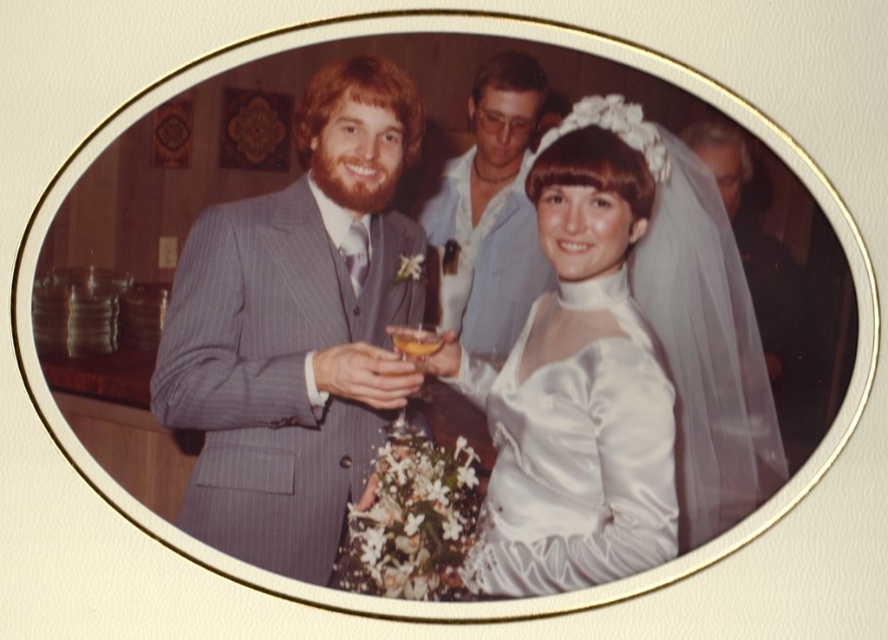
Question: Which of these objects is positioned farthest from the pinstriped suit at center?

Choices:
 (A) translucent white veil at upper right
 (B) light blue shirt at center

Answer: (A)

Question: Among these points, which one is farthest from the camera?

Choices:
 (A) (553, 564)
 (B) (456, 164)
 (C) (419, 346)

Answer: (B)

Question: Is pinstriped suit at center to the left of translucent glass wine glass at center from the viewer's perspective?

Choices:
 (A) yes
 (B) no

Answer: (A)

Question: Which object is positioned closest to the translucent white veil at upper right?

Choices:
 (A) satin white dress at center
 (B) translucent glass at center
 (C) pinstriped suit at center

Answer: (A)

Question: Can you confirm if translucent white veil at upper right is positioned below translucent glass at center?

Choices:
 (A) no
 (B) yes

Answer: (A)

Question: Can you confirm if light blue shirt at center is positioned above translucent glass wine glass at center?

Choices:
 (A) yes
 (B) no

Answer: (A)